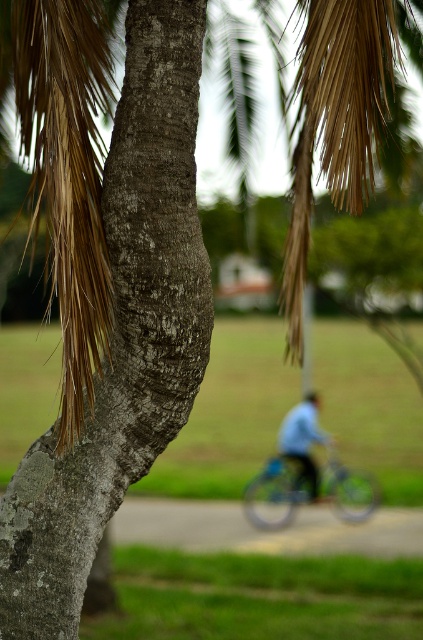
Question: Does metallic blue bicycle at center appear on the left side of blue matte shirt at center?

Choices:
 (A) yes
 (B) no

Answer: (B)

Question: Which point is closer to the camera taking this photo?

Choices:
 (A) (258, 508)
 (B) (318, 492)

Answer: (A)

Question: Observing the image, what is the correct spatial positioning of metallic blue bicycle at center in reference to blue matte shirt at center?

Choices:
 (A) below
 (B) above

Answer: (A)

Question: Can you confirm if metallic blue bicycle at center is smaller than blue matte shirt at center?

Choices:
 (A) no
 (B) yes

Answer: (A)

Question: Which point is farther to the camera?

Choices:
 (A) (318, 426)
 (B) (326, 468)

Answer: (A)

Question: Which point appears farthest from the camera in this image?

Choices:
 (A) (327, 458)
 (B) (315, 424)

Answer: (A)